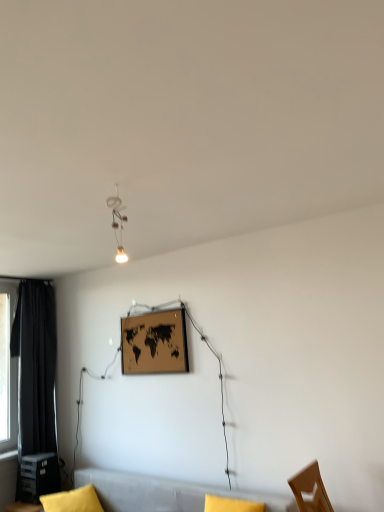
Question: Is matte black plastic table at lower left oriented away from soft gray couch at lower center?

Choices:
 (A) no
 (B) yes

Answer: (A)

Question: From a real-world perspective, does matte black plastic table at lower left sit lower than soft gray couch at lower center?

Choices:
 (A) yes
 (B) no

Answer: (B)

Question: Is there a large distance between matte black plastic table at lower left and soft gray couch at lower center?

Choices:
 (A) no
 (B) yes

Answer: (A)

Question: Is matte black plastic table at lower left thinner than soft gray couch at lower center?

Choices:
 (A) yes
 (B) no

Answer: (A)

Question: From a real-world perspective, is matte black plastic table at lower left on soft gray couch at lower center?

Choices:
 (A) no
 (B) yes

Answer: (B)

Question: Considering their positions, is black fabric curtain at left located in front of or behind soft gray couch at lower center?

Choices:
 (A) front
 (B) behind

Answer: (B)

Question: Looking at the image, does black fabric curtain at left seem bigger or smaller compared to soft gray couch at lower center?

Choices:
 (A) small
 (B) big

Answer: (A)

Question: Choose the correct answer: Is black fabric curtain at left inside soft gray couch at lower center or outside it?

Choices:
 (A) outside
 (B) inside

Answer: (A)

Question: Considering the relative positions of black fabric curtain at left and soft gray couch at lower center in the image provided, is black fabric curtain at left to the left or to the right of soft gray couch at lower center?

Choices:
 (A) left
 (B) right

Answer: (A)

Question: From a real-world perspective, is black fabric curtain at left above or below matte white lamp at upper center?

Choices:
 (A) below
 (B) above

Answer: (A)

Question: From the image's perspective, relative to matte white lamp at upper center, is black fabric curtain at left above or below?

Choices:
 (A) below
 (B) above

Answer: (A)

Question: Looking at their shapes, would you say black fabric curtain at left is wider or thinner than matte white lamp at upper center?

Choices:
 (A) wide
 (B) thin

Answer: (A)

Question: Would you say black fabric curtain at left is inside or outside matte white lamp at upper center?

Choices:
 (A) outside
 (B) inside

Answer: (A)

Question: Relative to black fabric curtain at left, is yellow fabric pillow at lower left in front or behind?

Choices:
 (A) front
 (B) behind

Answer: (A)

Question: From the image's perspective, is yellow fabric pillow at lower left located above or below black fabric curtain at left?

Choices:
 (A) above
 (B) below

Answer: (B)